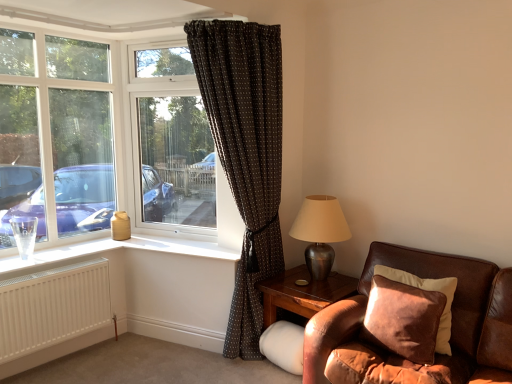
Where is `vacant area that is situated to the right of white matte radiator at lower left`? The width and height of the screenshot is (512, 384). vacant area that is situated to the right of white matte radiator at lower left is located at coordinates (123, 362).